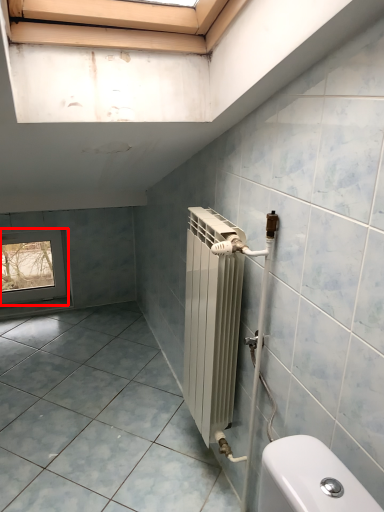
Question: From the image's perspective, where is window (annotated by the red box) located relative to ceramic tile?

Choices:
 (A) below
 (B) above

Answer: (B)